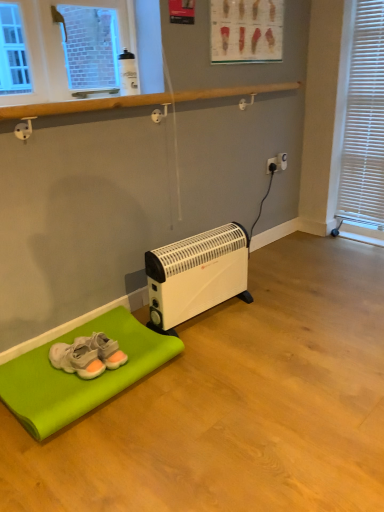
Locate an element on the screen. The width and height of the screenshot is (384, 512). free space in front of gray suede sneakers at lower left is located at coordinates (62, 393).